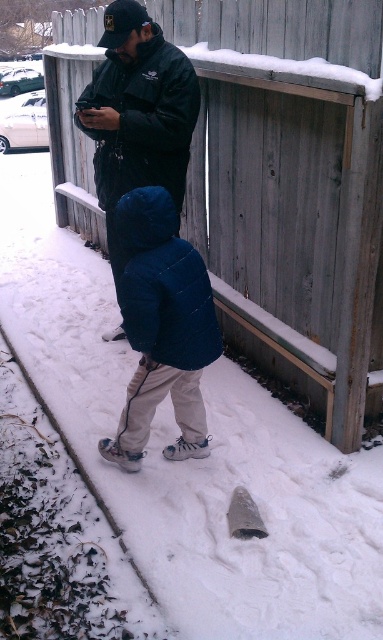
How far apart are dark blue puffy jacket at center and matte black jacket at center?

dark blue puffy jacket at center is 3.62 feet from matte black jacket at center.

Looking at this image, who is higher up, dark blue puffy jacket at center or matte black jacket at center?

matte black jacket at center is above.

Who is more distant from viewer, [199,372] or [140,22]?

Point [140,22]

Identify the location of dark blue puffy jacket at center. click(162, 328).

Between point (103, 38) and point (194, 312), which one is positioned in front?

Point (194, 312) is more forward.

Can you confirm if gray wood fence at upper center is positioned to the right of dark blue puffy jacket at center?

Indeed, gray wood fence at upper center is positioned on the right side of dark blue puffy jacket at center.

The width and height of the screenshot is (383, 640). What do you see at coordinates (291, 182) in the screenshot?
I see `gray wood fence at upper center` at bounding box center [291, 182].

Where is `gray wood fence at upper center`? gray wood fence at upper center is located at coordinates (291, 182).

Between gray wood fence at upper center and matte black jacket at center, which one has more height?

Standing taller between the two is gray wood fence at upper center.

Between gray wood fence at upper center and matte black jacket at center, which one is positioned higher?

matte black jacket at center is above.

Who is more distant from viewer, (360, 296) or (122, 141)?

Positioned behind is point (122, 141).

This screenshot has width=383, height=640. I want to click on gray wood fence at upper center, so click(x=291, y=182).